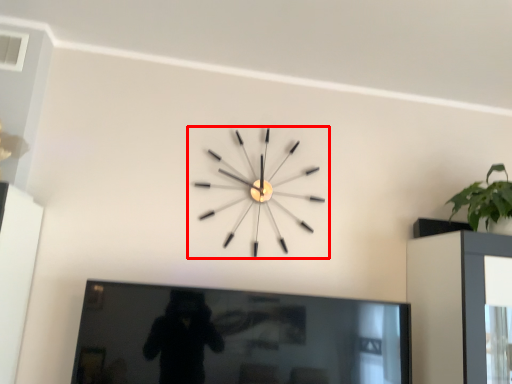
Question: From the image, what is the correct spatial relationship of wall clock (annotated by the red box) in relation to picture frame?

Choices:
 (A) left
 (B) right

Answer: (B)